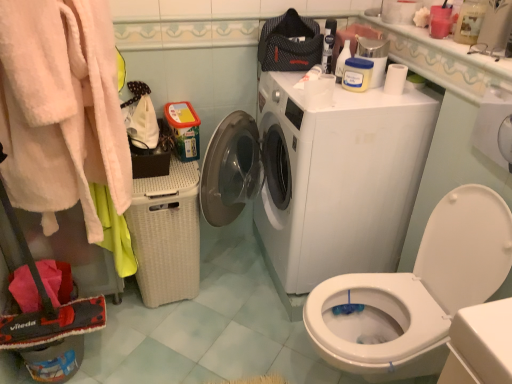
Question: From a real-world perspective, is white glossy countertop at upper right located higher than white wicker laundry basket at left?

Choices:
 (A) no
 (B) yes

Answer: (B)

Question: Considering the relative sizes of white glossy countertop at upper right and white wicker laundry basket at left in the image provided, is white glossy countertop at upper right thinner than white wicker laundry basket at left?

Choices:
 (A) yes
 (B) no

Answer: (A)

Question: Is white glossy countertop at upper right positioned behind white wicker laundry basket at left?

Choices:
 (A) yes
 (B) no

Answer: (B)

Question: Is white glossy countertop at upper right at the right side of white wicker laundry basket at left?

Choices:
 (A) no
 (B) yes

Answer: (B)

Question: Is white glossy countertop at upper right oriented towards white wicker laundry basket at left?

Choices:
 (A) no
 (B) yes

Answer: (A)

Question: Is white glossy washing machine at center bigger or smaller than white wicker laundry basket at left?

Choices:
 (A) big
 (B) small

Answer: (A)

Question: Is white glossy washing machine at center taller or shorter than white wicker laundry basket at left?

Choices:
 (A) tall
 (B) short

Answer: (A)

Question: Is white glossy washing machine at center wider or thinner than white wicker laundry basket at left?

Choices:
 (A) wide
 (B) thin

Answer: (A)

Question: From a real-world perspective, relative to white wicker laundry basket at left, is white glossy washing machine at center vertically above or below?

Choices:
 (A) above
 (B) below

Answer: (A)

Question: Is white matte toilet paper at upper right, which appears as the 1th toilet paper when viewed from the left, bigger or smaller than fluffy pink bathrobe at left?

Choices:
 (A) small
 (B) big

Answer: (A)

Question: Is white matte toilet paper at upper right, acting as the second toilet paper starting from the right, taller or shorter than fluffy pink bathrobe at left?

Choices:
 (A) tall
 (B) short

Answer: (B)

Question: In terms of width, does white matte toilet paper at upper right, which is the first toilet paper in front-to-back order, look wider or thinner when compared to fluffy pink bathrobe at left?

Choices:
 (A) wide
 (B) thin

Answer: (B)

Question: Is point (308, 82) positioned closer to the camera than point (65, 115)?

Choices:
 (A) closer
 (B) farther

Answer: (B)

Question: Choose the correct answer: Is white glossy washing machine at center inside fluffy pink bathrobe at left or outside it?

Choices:
 (A) inside
 (B) outside

Answer: (B)

Question: From a real-world perspective, is white glossy washing machine at center above or below fluffy pink bathrobe at left?

Choices:
 (A) above
 (B) below

Answer: (B)